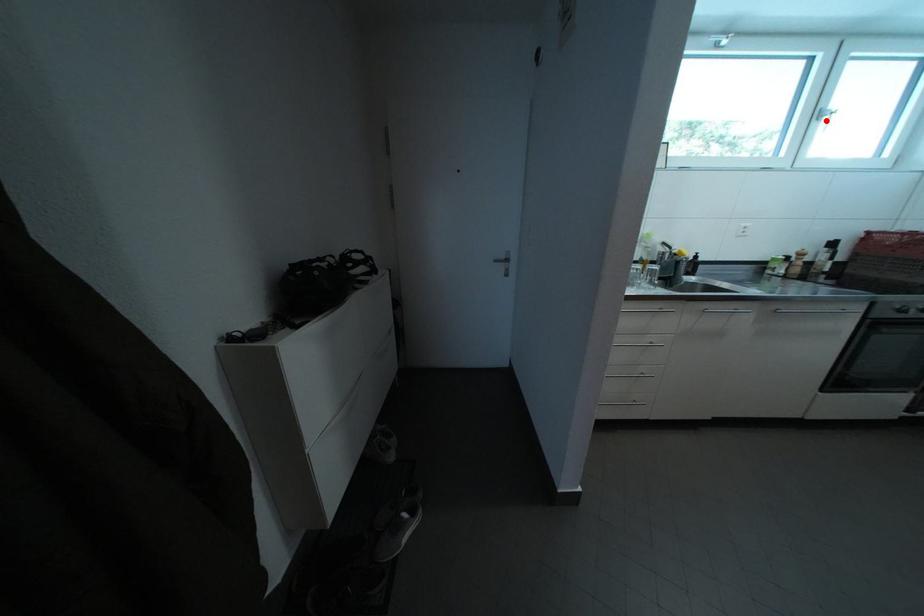
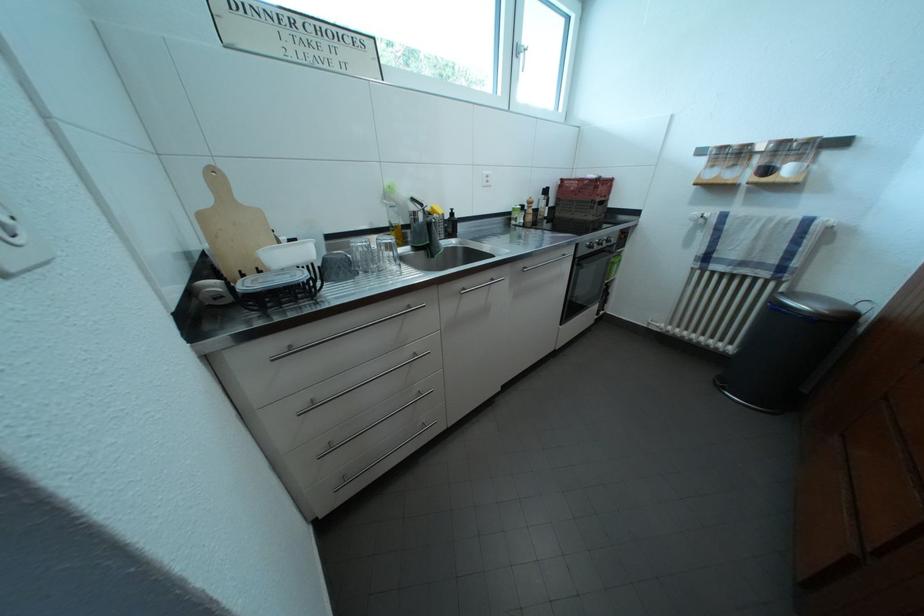
Find the pixel in the second image that matches the highlighted location in the first image.

(525, 55)